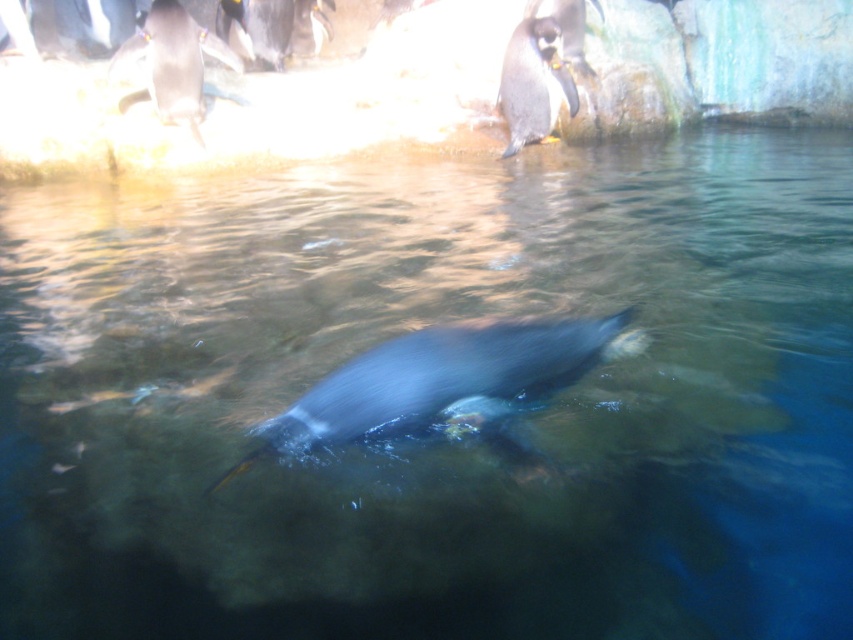
Question: Is black glossy penguin at upper left smaller than black matte penguin at upper center?

Choices:
 (A) yes
 (B) no

Answer: (B)

Question: Which object appears closest to the camera in this image?

Choices:
 (A) black glossy penguin at upper right
 (B) black matte penguin at upper center

Answer: (B)

Question: Where is black glossy penguin at upper left located in relation to black glossy penguin at upper right in the image?

Choices:
 (A) below
 (B) above

Answer: (A)

Question: Which of the following is the farthest from the observer?

Choices:
 (A) (554, 58)
 (B) (561, 17)

Answer: (B)

Question: Which point is closer to the camera?

Choices:
 (A) shiny black penguin at center
 (B) black glossy penguin at upper right
 (C) black glossy penguin at upper left

Answer: (A)

Question: Considering the relative positions of black glossy penguin at upper left and black matte penguin at upper center in the image provided, where is black glossy penguin at upper left located with respect to black matte penguin at upper center?

Choices:
 (A) left
 (B) right

Answer: (A)